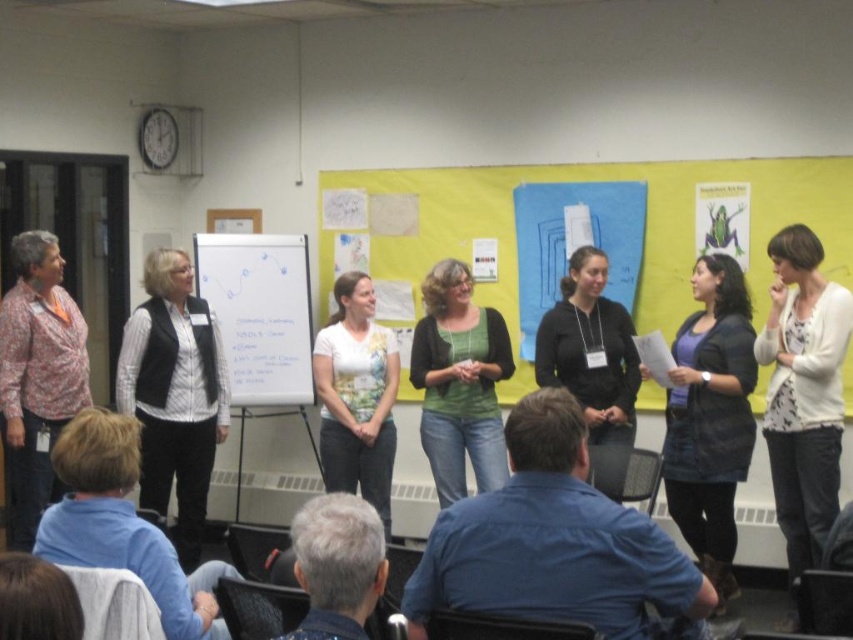
Can you confirm if denim skirt at center is positioned above whiteboard at center?

No, denim skirt at center is not above whiteboard at center.

Who is more forward, (x=728, y=330) or (x=247, y=381)?

Positioned in front is point (x=728, y=330).

Is point (718, 417) in front of point (257, 312)?

Yes, it is in front of point (257, 312).

Identify the location of denim skirt at center. Image resolution: width=853 pixels, height=640 pixels. (711, 417).

The width and height of the screenshot is (853, 640). Describe the element at coordinates (711, 417) in the screenshot. I see `denim skirt at center` at that location.

Does denim skirt at center have a lesser height compared to green matte sweater at center?

No.

Between point (692, 392) and point (430, 413), which one is positioned behind?

Point (430, 413)

Identify the location of denim skirt at center. The width and height of the screenshot is (853, 640). (711, 417).

Does white textured cardigan at center have a greater height compared to floral print shirt at left?

Correct, white textured cardigan at center is much taller as floral print shirt at left.

Can you confirm if white textured cardigan at center is positioned to the left of floral print shirt at left?

Incorrect, white textured cardigan at center is not on the left side of floral print shirt at left.

Image resolution: width=853 pixels, height=640 pixels. I want to click on white textured cardigan at center, so click(x=804, y=392).